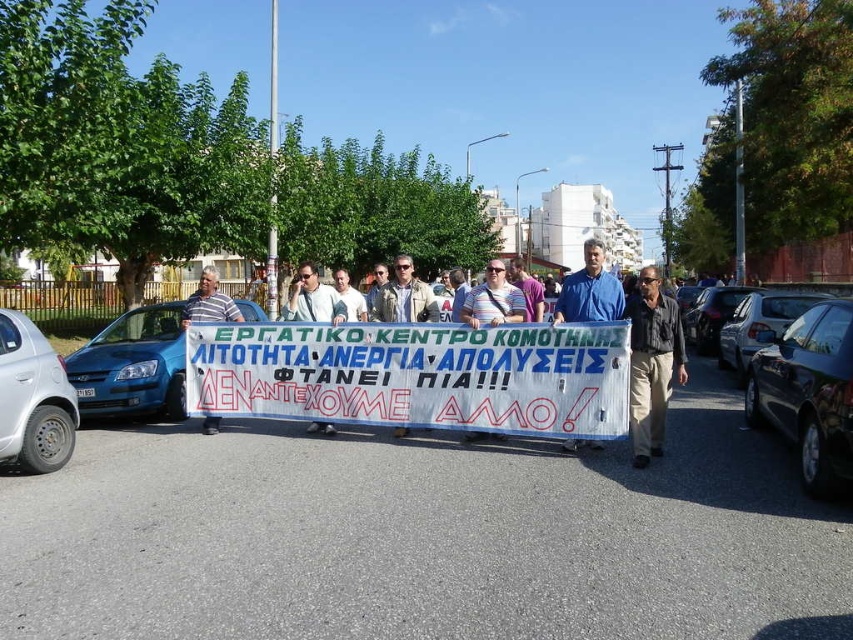
You are a pedestrian standing at the intersection, and you see the shiny black car at right and the white plastic sign at center. If you want to reach the sign first before the car, how much distance do you need to cover compared to the car?

The shiny black car at right is 5.67 meters away from the white plastic sign at center. To reach the sign before the car, you need to cover the distance to the sign, which is 5.67 meters, while the car has to cover its own distance of 5.67 meters. The answer depends on your speed relative to the car, but the distance to the sign is the same for both you and the car.

You are a photographer trying to capture the protest group. You notice two black cars in the frame. The black glossy car at right and the black glossy sedan at center. Which car should you focus on to ensure it appears larger in your photo?

The black glossy car at right is larger in size compared to the black glossy sedan at center, so focusing on it will make it appear larger in the photo.